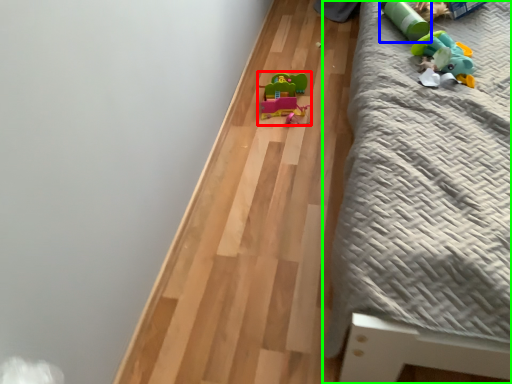
Question: Estimate the real-world distances between objects in this image. Which object is farther from toy (highlighted by a red box), toy (highlighted by a blue box) or furniture (highlighted by a green box)?

Choices:
 (A) toy
 (B) furniture

Answer: (B)